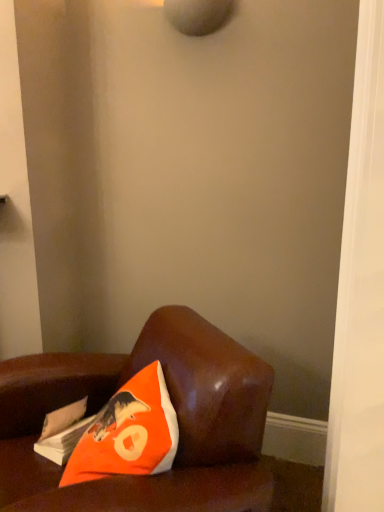
Question: From the image's perspective, is orange fabric pillow at lower left under brown leather couch at lower left?

Choices:
 (A) yes
 (B) no

Answer: (B)

Question: From the image's perspective, does orange fabric pillow at lower left appear higher than brown leather couch at lower left?

Choices:
 (A) no
 (B) yes

Answer: (B)

Question: Is orange fabric pillow at lower left oriented towards brown leather couch at lower left?

Choices:
 (A) no
 (B) yes

Answer: (B)

Question: Is orange fabric pillow at lower left taller than brown leather couch at lower left?

Choices:
 (A) yes
 (B) no

Answer: (B)

Question: Is orange fabric pillow at lower left closer to camera compared to brown leather couch at lower left?

Choices:
 (A) yes
 (B) no

Answer: (B)

Question: Can you confirm if orange fabric pillow at lower left is wider than brown leather couch at lower left?

Choices:
 (A) yes
 (B) no

Answer: (B)

Question: Considering the relative sizes of white paper magazine at lower left and orange fabric pillow at lower left in the image provided, is white paper magazine at lower left taller than orange fabric pillow at lower left?

Choices:
 (A) no
 (B) yes

Answer: (A)

Question: Is white paper magazine at lower left placed right next to orange fabric pillow at lower left?

Choices:
 (A) yes
 (B) no

Answer: (B)

Question: Can orange fabric pillow at lower left be found inside white paper magazine at lower left?

Choices:
 (A) yes
 (B) no

Answer: (B)

Question: Considering the relative sizes of white paper magazine at lower left and orange fabric pillow at lower left in the image provided, is white paper magazine at lower left shorter than orange fabric pillow at lower left?

Choices:
 (A) yes
 (B) no

Answer: (A)

Question: Is white paper magazine at lower left not near orange fabric pillow at lower left?

Choices:
 (A) no
 (B) yes

Answer: (A)

Question: Does white paper magazine at lower left turn towards orange fabric pillow at lower left?

Choices:
 (A) yes
 (B) no

Answer: (B)

Question: Is orange fabric pillow at lower left next to white paper magazine at lower left and touching it?

Choices:
 (A) no
 (B) yes

Answer: (A)